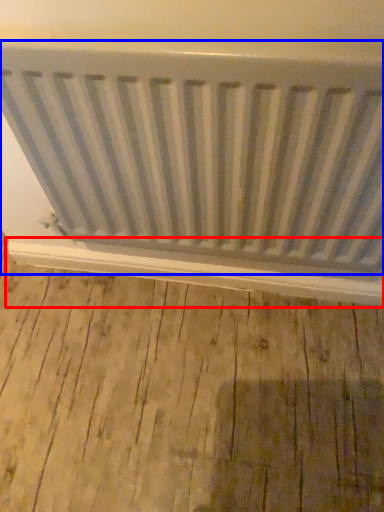
Question: Which point is closer to the camera, window sill (highlighted by a red box) or radiator (highlighted by a blue box)?

Choices:
 (A) window sill
 (B) radiator

Answer: (B)